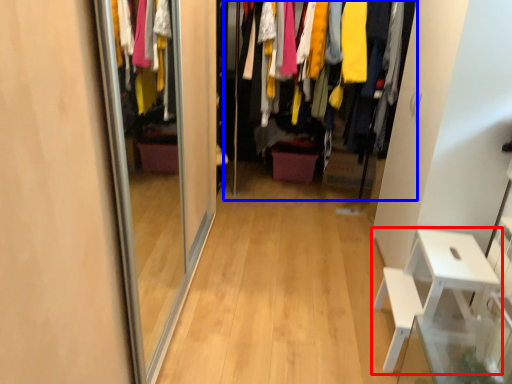
Question: Which object appears farthest to the camera in this image, furniture (highlighted by a red box) or closet (highlighted by a blue box)?

Choices:
 (A) furniture
 (B) closet

Answer: (B)